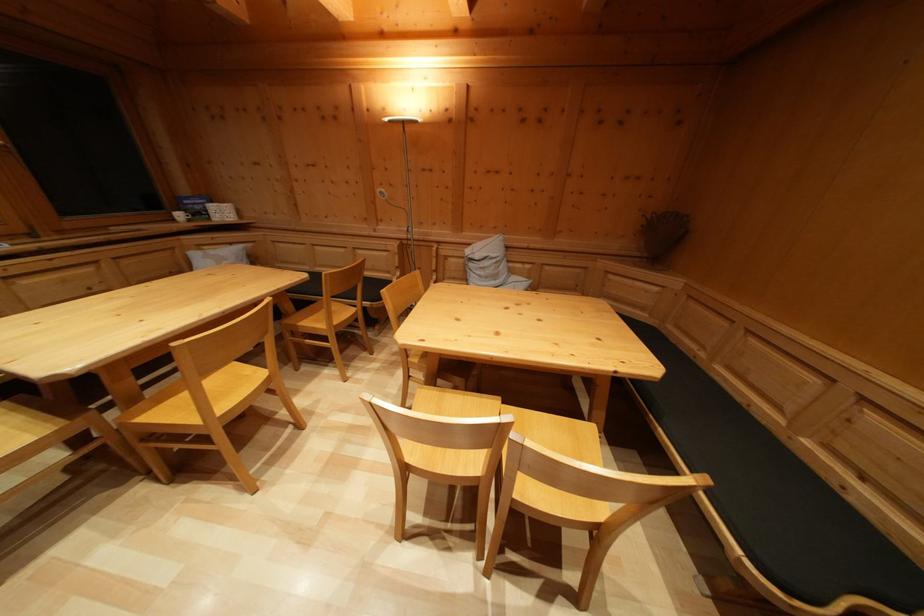
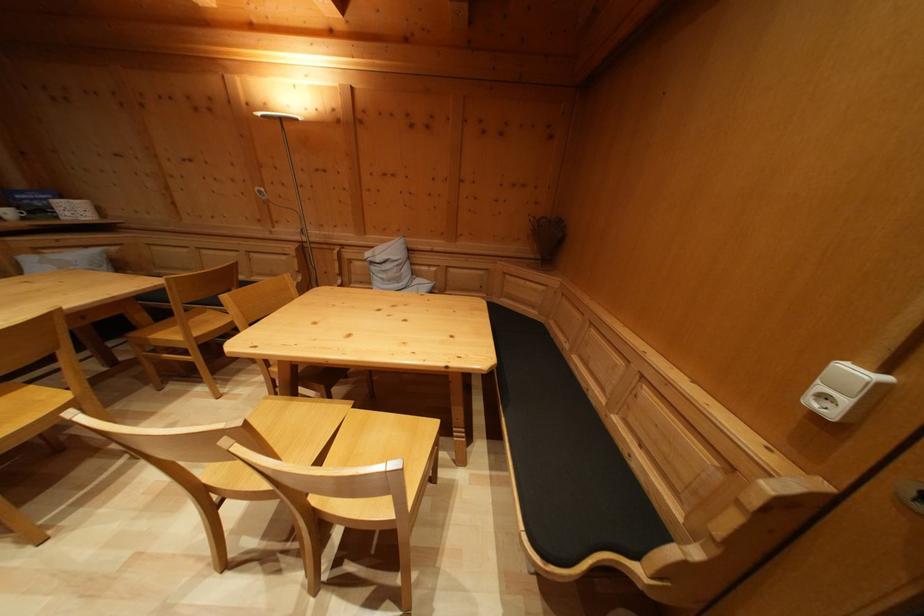
In the second image, find the point that corresponds to pixel 186 223 in the first image.

(14, 219)